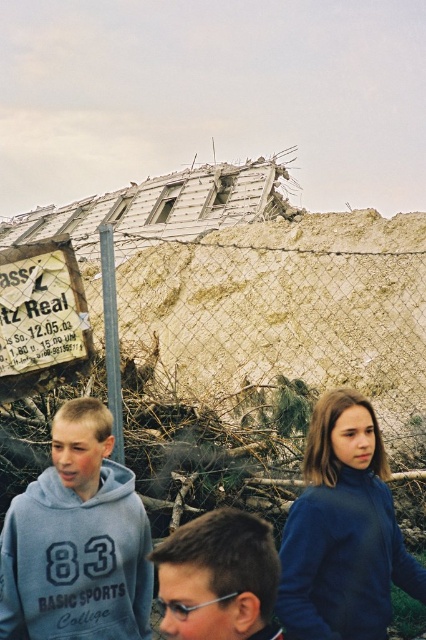
Question: Which point is farther to the camera?

Choices:
 (A) dark brown hair at center
 (B) blue fleece jacket at center

Answer: (B)

Question: Among these points, which one is farthest from the camera?

Choices:
 (A) (51, 403)
 (B) (14, 540)

Answer: (A)

Question: Estimate the real-world distances between objects in this image. Which object is closer to the dark brown hair at center?

Choices:
 (A) blue fleece jacket at center
 (B) wire mesh fence at center

Answer: (A)

Question: Can you confirm if blue fleece jacket at center is positioned to the left of dark brown hair at center?

Choices:
 (A) yes
 (B) no

Answer: (B)

Question: Is wire mesh fence at center thinner than blue fleece jacket at center?

Choices:
 (A) yes
 (B) no

Answer: (B)

Question: Does blue fleece jacket at center have a larger size compared to dark brown hair at center?

Choices:
 (A) no
 (B) yes

Answer: (B)